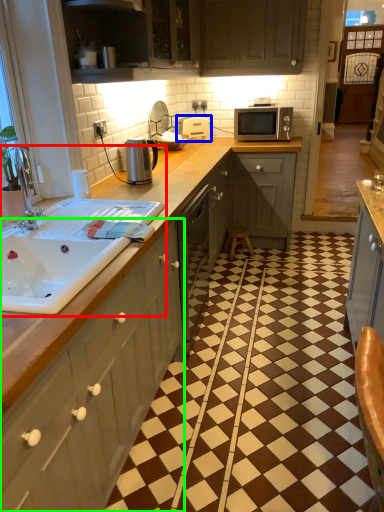
Question: Which is nearer to the sink (highlighted by a red box)? appliance (highlighted by a blue box) or cabinetry (highlighted by a green box).

Choices:
 (A) appliance
 (B) cabinetry

Answer: (B)